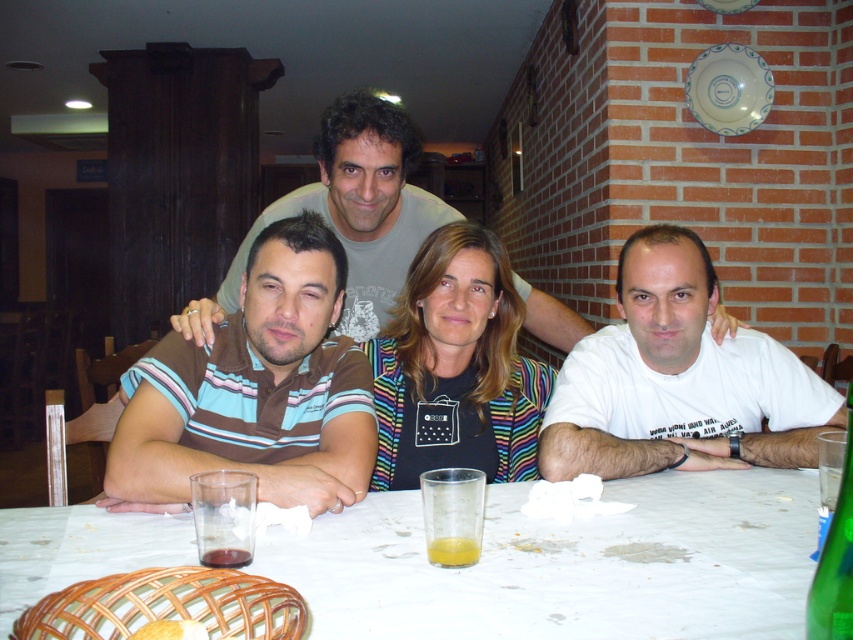
Consider the image. You are standing at the entrance of the dining area and want to locate the white cotton shirt at right. Based on the coordinates provided, where should you look relative to the center of the image?

The white cotton shirt at right is located at coordinates 0.595 on the x axis and 0.796 on the y axis, which places it to the right and slightly above the center of the image.

Based on the photo, you are a server at a restaurant and need to place a large dessert plate on the table. The dessert plate is bigger than the translucent glass. Based on the scene, can you confirm if the white paper table at center has enough space to accommodate the dessert plate without overlapping the translucent glass at table center?

The white paper table at center has a larger size compared to the translucent glass at table center. Since the dessert plate is bigger than the translucent glass, there should be sufficient space on the white paper table at center to place the dessert plate without overlapping the glass.